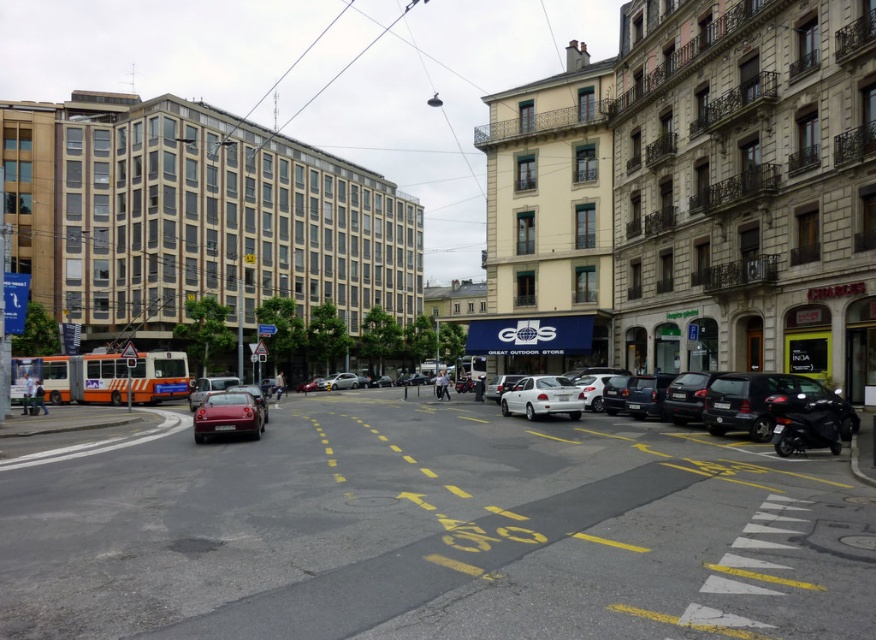
Can you confirm if white matte sedan at center-right is taller than white matte car at center?

No.

Which is more to the right, white matte sedan at center-right or white matte car at center?

white matte sedan at center-right is more to the right.

Which is in front, point (505, 390) or point (484, 396)?

Point (505, 390) is in front.

Where is `white matte sedan at center-right`? white matte sedan at center-right is located at coordinates (542, 397).

The image size is (876, 640). Describe the element at coordinates (542, 397) in the screenshot. I see `white matte sedan at center-right` at that location.

Who is higher up, white matte sedan at center-right or shiny red car at center?

Positioned higher is white matte sedan at center-right.

Does point (564, 396) come behind point (196, 417)?

Yes, point (564, 396) is farther from viewer.

Where is `white matte sedan at center-right`? This screenshot has height=640, width=876. white matte sedan at center-right is located at coordinates (542, 397).

Locate an element on the screen. Image resolution: width=876 pixels, height=640 pixels. smooth asphalt road at center is located at coordinates (433, 531).

Consider the image. Can you confirm if smooth asphalt road at center is smaller than black matte car at right?

Incorrect, smooth asphalt road at center is not smaller in size than black matte car at right.

Is point (260, 499) closer to viewer compared to point (743, 406)?

That is True.

Find the location of a particular element. The height and width of the screenshot is (640, 876). smooth asphalt road at center is located at coordinates (433, 531).